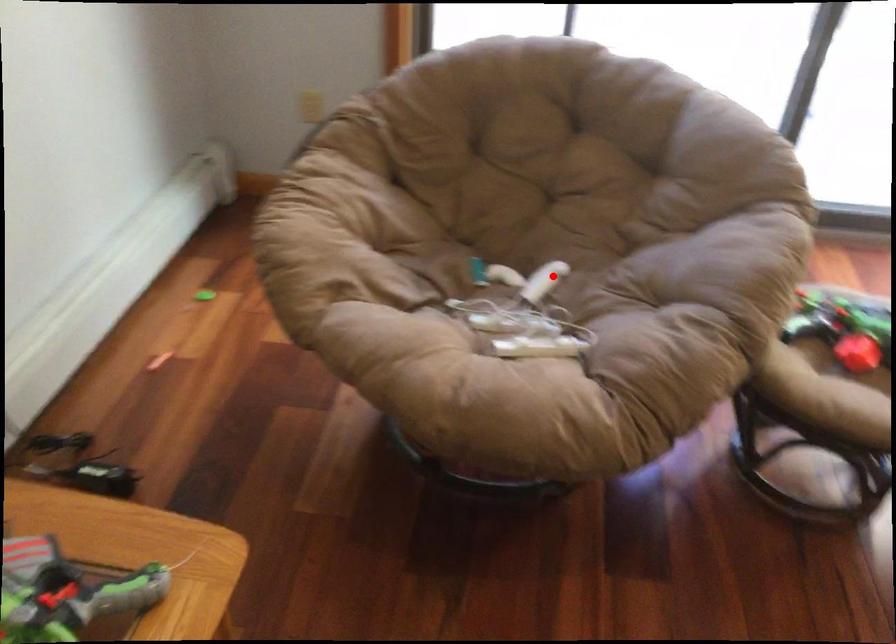
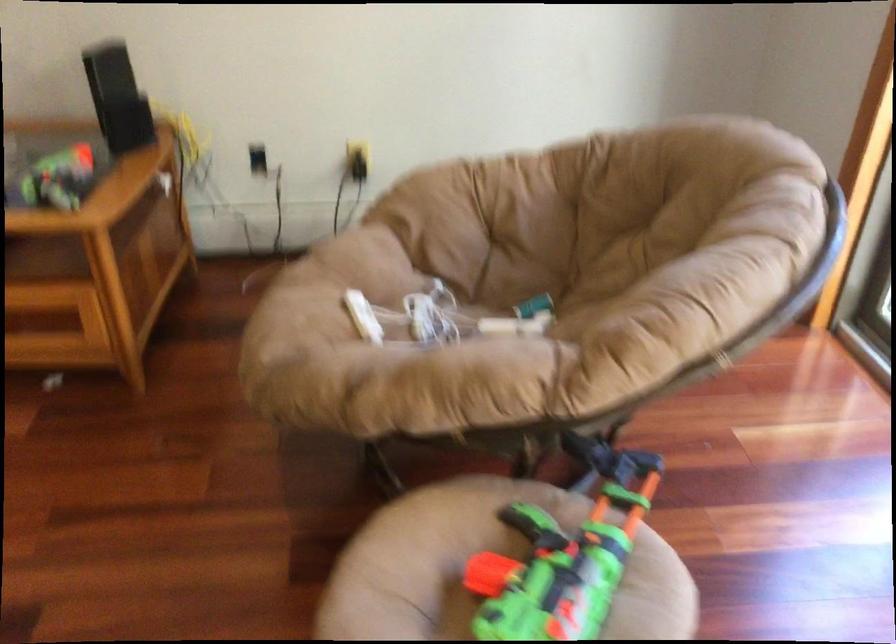
Find the pixel in the second image that matches the highlighted location in the first image.

(512, 326)